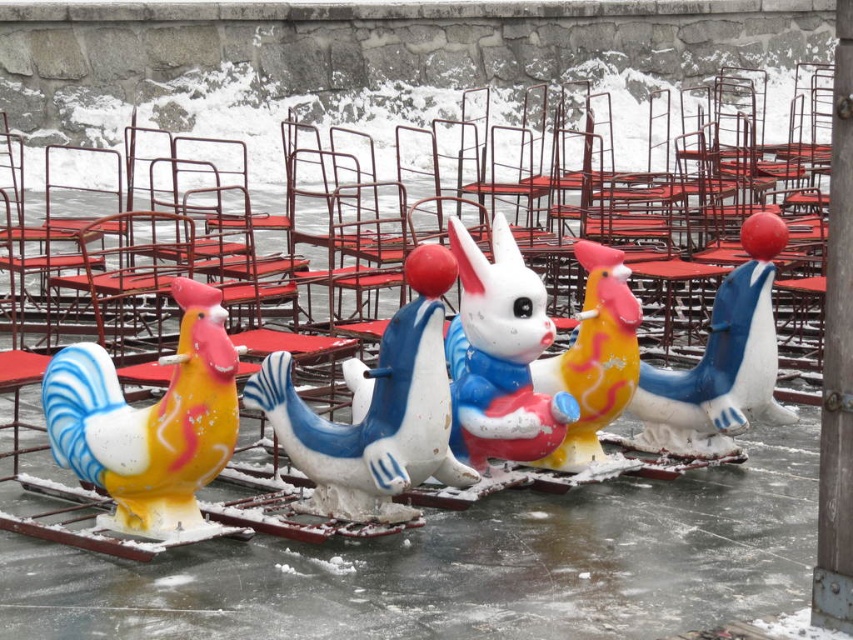
Question: Does matte plastic chicken at left appear over yellow matte chicken at center?

Choices:
 (A) no
 (B) yes

Answer: (A)

Question: Which object is positioned closest to the matte plastic duck at center?

Choices:
 (A) matte plastic rabbit at center
 (B) yellow matte chicken at center

Answer: (B)

Question: Does matte plastic duck at center have a smaller size compared to yellow matte chicken at center?

Choices:
 (A) no
 (B) yes

Answer: (A)

Question: Among these points, which one is nearest to the camera?

Choices:
 (A) (520, 394)
 (B) (666, 392)
 (C) (628, 387)
 (D) (122, 518)

Answer: (D)

Question: Among these objects, which one is farthest from the camera?

Choices:
 (A) matte plastic duck at center
 (B) matte plastic chicken at left
 (C) matte plastic rabbit at center
 (D) yellow matte chicken at center

Answer: (A)

Question: Is matte plastic chicken at left wider than matte plastic rabbit at center?

Choices:
 (A) yes
 (B) no

Answer: (A)